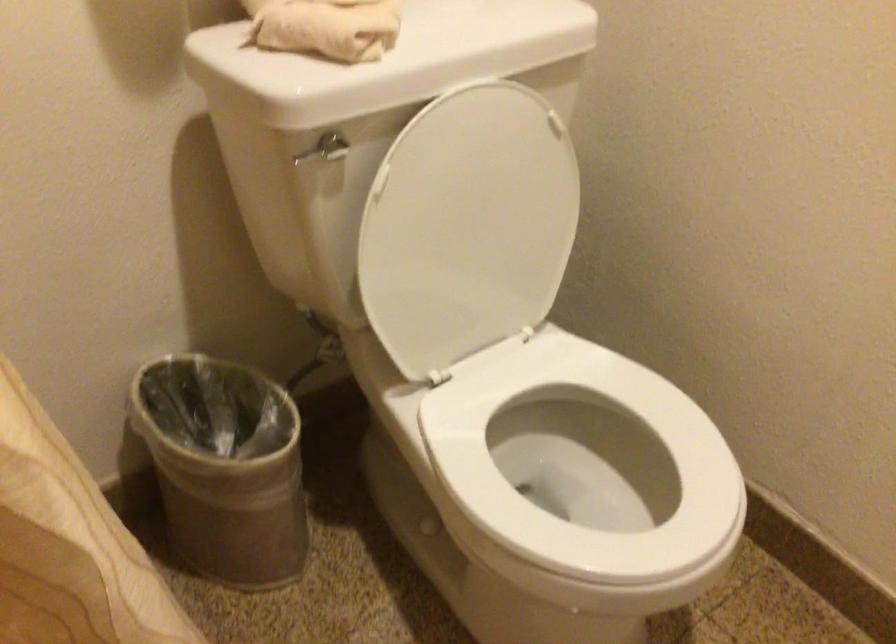
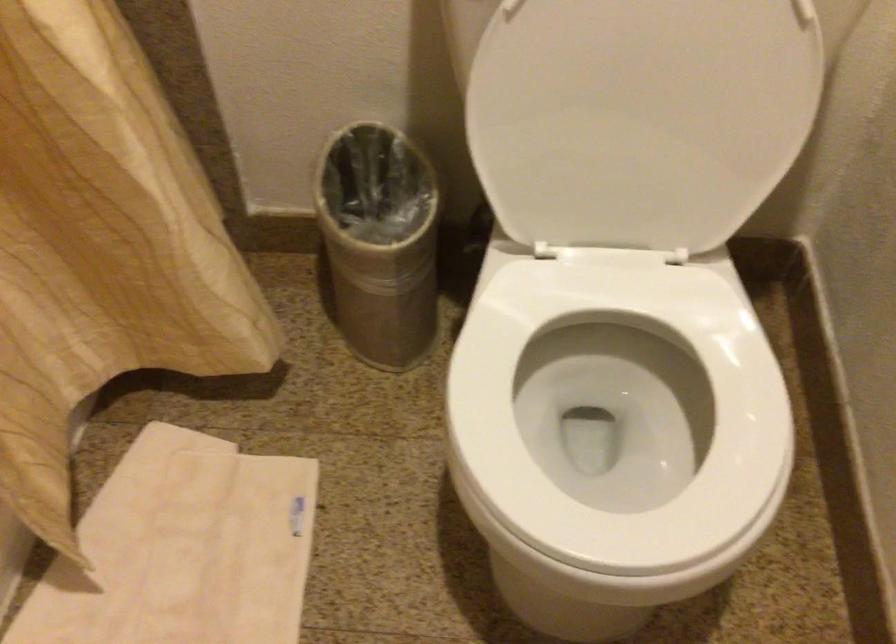
Where in the second image is the point corresponding to point (277, 453) from the first image?

(380, 242)